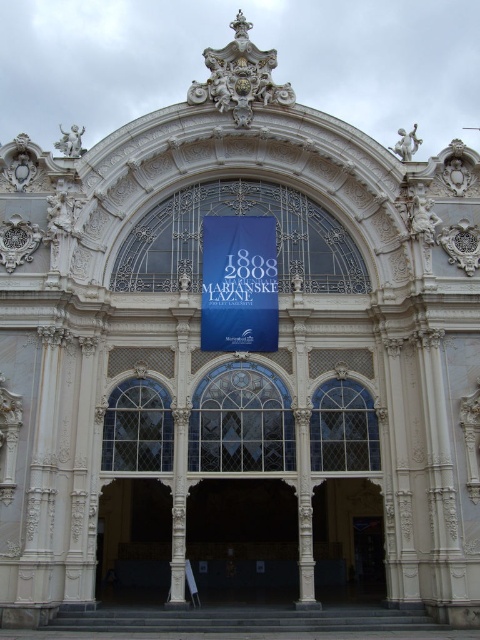
Can you confirm if blue fabric banner at center is positioned above white stone archway at center?

Yes, blue fabric banner at center is above white stone archway at center.

Who is more forward, (237, 346) or (324, 593)?

Point (237, 346) is in front.

Is point (233, 225) closer to camera compared to point (348, 595)?

No, it is behind (348, 595).

This screenshot has width=480, height=640. I want to click on blue fabric banner at center, so click(x=239, y=284).